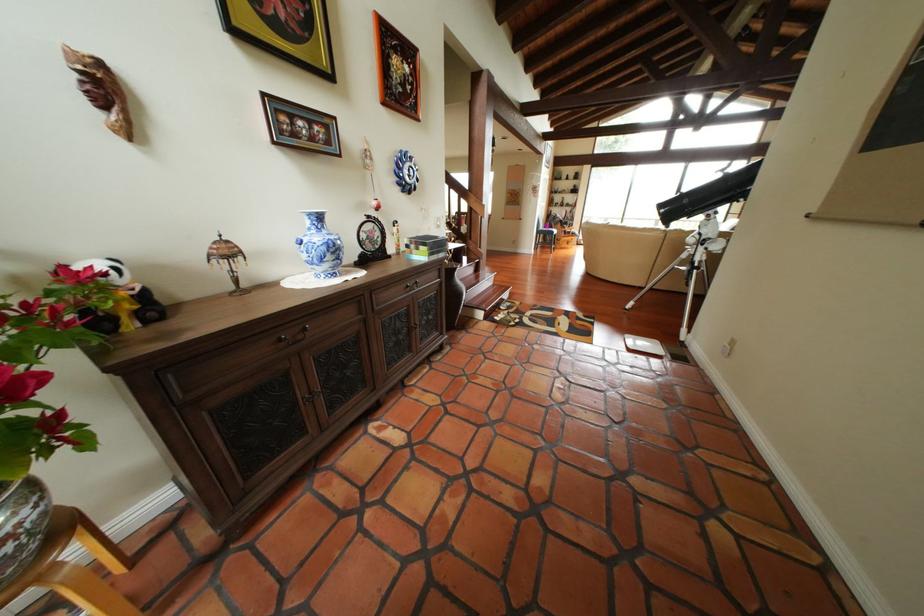
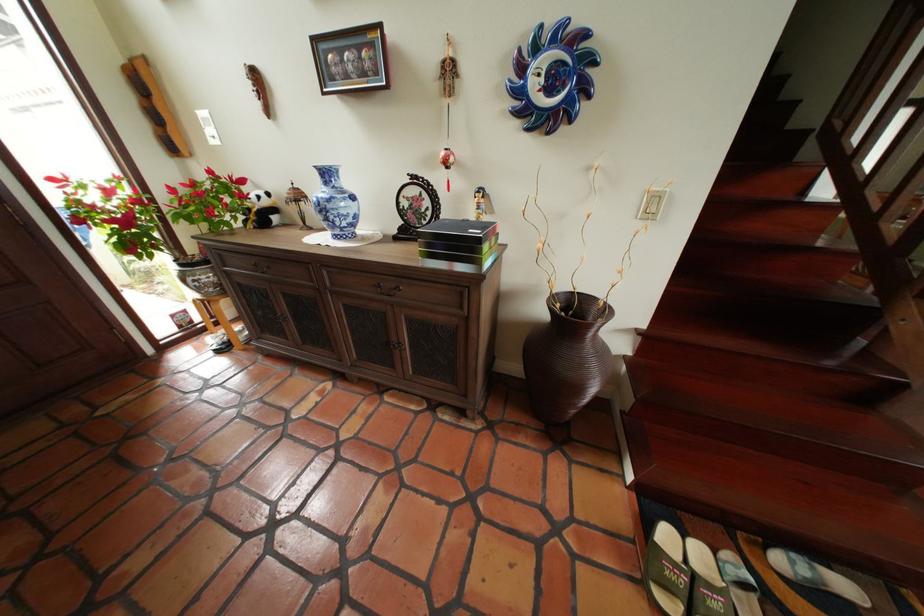
The point at (x=390, y=246) is marked in the first image. Where is the corresponding point in the second image?

(438, 221)